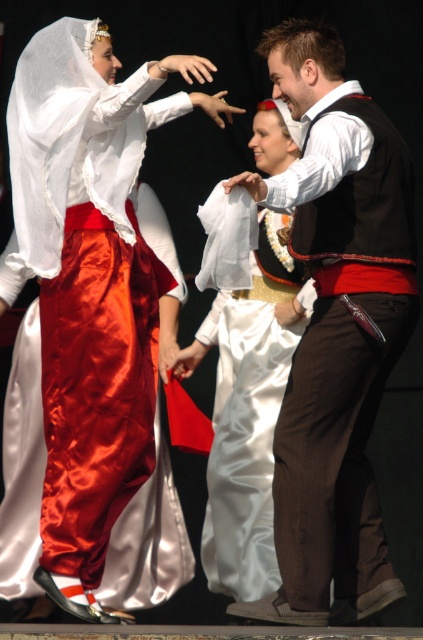
You are a stagehand who needs to position a spotlight on the stage. The spotlight can only illuminate objects in front of the point at coordinates point [10,400]. Will the point at coordinates point [282,120] be illuminated by the spotlight?

Point [282,120] is behind point [10,400], so it will not be illuminated by the spotlight since it is positioned behind the point the spotlight is focused on.